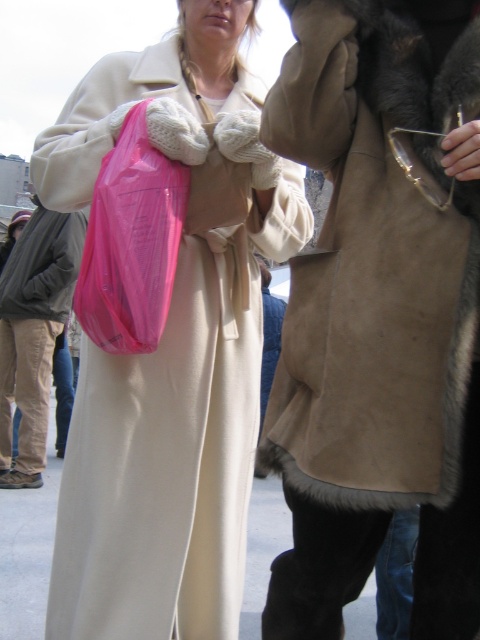
Is point (298, 172) in front of point (333, 138)?

No, (298, 172) is further to viewer.

Does matte plastic bag at center appear on the right side of suede fur coat at right?

Incorrect, matte plastic bag at center is not on the right side of suede fur coat at right.

Is point (132, 404) in front of point (407, 406)?

No, it is behind (407, 406).

This screenshot has height=640, width=480. What are the coordinates of `matte plastic bag at center` in the screenshot? It's located at (170, 342).

Is point (108, 72) in front of point (119, 202)?

That is False.

Where is `matte plastic bag at center`? matte plastic bag at center is located at coordinates (170, 342).

Does suede fur coat at right appear over matte beige coat at lower left?

Yes, suede fur coat at right is above matte beige coat at lower left.

The image size is (480, 640). Identify the location of suede fur coat at right. tap(373, 264).